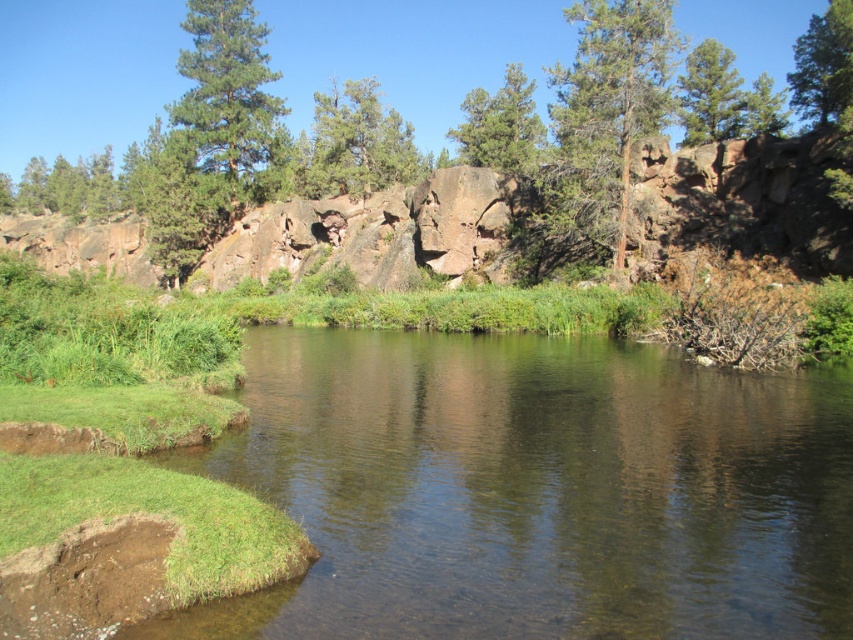
You are an environmental scientist studying the trees in this landscape. You need to determine which tree has a larger size between the green rough bark tree at upper center and the green textured pine tree at center. Based on the scene, which one is bigger?

The green rough bark tree at upper center is bigger than the green textured pine tree at center.

You are an environmental scientist observing the landscape. You notice two trees in the scene. Which tree is located to the right of the other? The trees are the green rough bark tree at upper center and the green textured pine tree at center.

The green rough bark tree at upper center is positioned on the right side of the green textured pine tree at center.

You are an artist planning to paint the serene natural landscape. You want to ensure the green matte tree at upper right and the green matte tree at upper center are proportionally accurate. Which tree should you draw larger in your painting?

The green matte tree at upper right should be drawn larger than the green matte tree at upper center because the description states it is bigger.